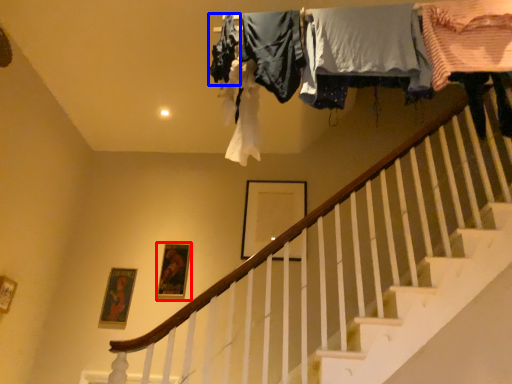
Question: Which point is closer to the camera, picture frame (highlighted by a red box) or clothing (highlighted by a blue box)?

Choices:
 (A) picture frame
 (B) clothing

Answer: (B)